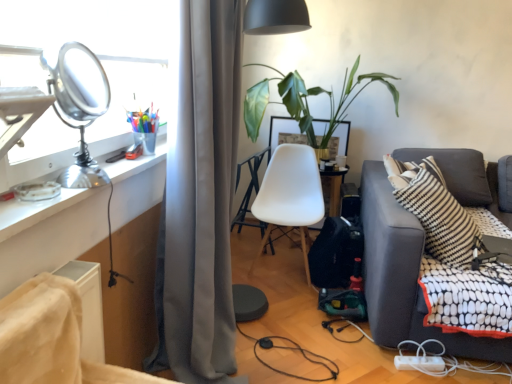
Question: Can you confirm if velvet-like beige chair at lower left, the 1th chair in the left-to-right sequence, is taller than shiny metallic table lamp at upper left?

Choices:
 (A) no
 (B) yes

Answer: (A)

Question: Is the surface of velvet-like beige chair at lower left, marked as the second chair in a right-to-left arrangement, in direct contact with shiny metallic table lamp at upper left?

Choices:
 (A) yes
 (B) no

Answer: (B)

Question: Does velvet-like beige chair at lower left, the 1th chair in the left-to-right sequence, have a greater width compared to shiny metallic table lamp at upper left?

Choices:
 (A) no
 (B) yes

Answer: (B)

Question: Does velvet-like beige chair at lower left, marked as the second chair in a right-to-left arrangement, have a larger size compared to shiny metallic table lamp at upper left?

Choices:
 (A) yes
 (B) no

Answer: (A)

Question: Can you confirm if velvet-like beige chair at lower left, the 1th chair in the left-to-right sequence, is positioned to the left of shiny metallic table lamp at upper left?

Choices:
 (A) yes
 (B) no

Answer: (B)

Question: Is shiny metallic table lamp at upper left inside or outside of dark gray fabric couch at right?

Choices:
 (A) inside
 (B) outside

Answer: (B)

Question: Looking at the image, does shiny metallic table lamp at upper left seem bigger or smaller compared to dark gray fabric couch at right?

Choices:
 (A) small
 (B) big

Answer: (A)

Question: From the image's perspective, is shiny metallic table lamp at upper left above or below dark gray fabric couch at right?

Choices:
 (A) below
 (B) above

Answer: (B)

Question: Is point click(x=76, y=168) positioned closer to the camera than point click(x=401, y=223)?

Choices:
 (A) farther
 (B) closer

Answer: (B)

Question: From the image's perspective, is white plastic power strip at lower right located above or below black and white striped pillow at right?

Choices:
 (A) below
 (B) above

Answer: (A)

Question: Based on their sizes in the image, would you say white plastic power strip at lower right is bigger or smaller than black and white striped pillow at right?

Choices:
 (A) small
 (B) big

Answer: (A)

Question: Considering the positions of white plastic power strip at lower right and black and white striped pillow at right in the image, is white plastic power strip at lower right wider or thinner than black and white striped pillow at right?

Choices:
 (A) wide
 (B) thin

Answer: (B)

Question: Is white plastic power strip at lower right spatially inside black and white striped pillow at right, or outside of it?

Choices:
 (A) outside
 (B) inside

Answer: (A)

Question: Is velvet-like beige chair at lower left, marked as the second chair in a right-to-left arrangement, spatially inside metallic silver desk at left, or outside of it?

Choices:
 (A) inside
 (B) outside

Answer: (B)

Question: In the image, is velvet-like beige chair at lower left, the second chair positioned from the back, positioned in front of or behind metallic silver desk at left?

Choices:
 (A) front
 (B) behind

Answer: (A)